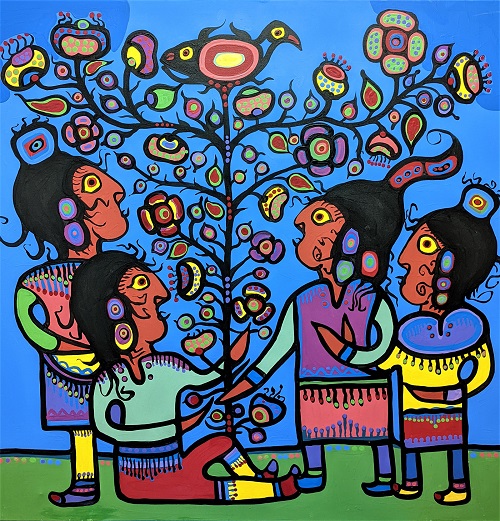
Where is `blue background of artwork`? blue background of artwork is located at coordinates (170, 16), (481, 136), (18, 377), (481, 423), (325, 14), (475, 23), (17, 16).